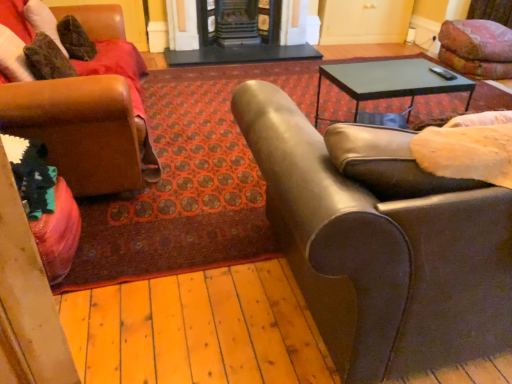
Question: Does marble fireplace at center, which is counted as the 1th fireplace, starting from the right, have a larger size compared to leather couch at right, the 2th chair when ordered from left to right?

Choices:
 (A) yes
 (B) no

Answer: (B)

Question: Is marble fireplace at center, the second fireplace positioned from the left, facing towards leather couch at right, the 1th chair viewed from the right?

Choices:
 (A) no
 (B) yes

Answer: (B)

Question: Does marble fireplace at center, which is counted as the 1th fireplace, starting from the right, have a lesser height compared to leather couch at right, the 2th chair when ordered from left to right?

Choices:
 (A) yes
 (B) no

Answer: (A)

Question: Is marble fireplace at center, which is counted as the 1th fireplace, starting from the right, beside leather couch at right, the 2th chair when ordered from left to right?

Choices:
 (A) no
 (B) yes

Answer: (A)

Question: Is marble fireplace at center, the second fireplace positioned from the left, far from leather couch at right, the 1th chair viewed from the right?

Choices:
 (A) yes
 (B) no

Answer: (A)

Question: Considering the relative sizes of marble fireplace at center, the second fireplace positioned from the left, and leather couch at right, the 1th chair viewed from the right, in the image provided, is marble fireplace at center, the second fireplace positioned from the left, taller than leather couch at right, the 1th chair viewed from the right,?

Choices:
 (A) no
 (B) yes

Answer: (A)

Question: Can you confirm if leather at left, the 1th chair in the left-to-right sequence, is positioned to the left of black glossy table at center?

Choices:
 (A) yes
 (B) no

Answer: (A)

Question: Is leather at left, the 1th chair in the left-to-right sequence, positioned before black glossy table at center?

Choices:
 (A) yes
 (B) no

Answer: (A)

Question: Would you consider leather at left, the 1th chair in the left-to-right sequence, to be distant from black glossy table at center?

Choices:
 (A) no
 (B) yes

Answer: (B)

Question: Is leather at left, the 1th chair in the left-to-right sequence, completely or partially outside of black glossy table at center?

Choices:
 (A) yes
 (B) no

Answer: (A)

Question: Does leather at left, the 1th chair in the left-to-right sequence, have a greater height compared to black glossy table at center?

Choices:
 (A) yes
 (B) no

Answer: (A)

Question: Is leather at left, the 1th chair in the left-to-right sequence, smaller than black glossy table at center?

Choices:
 (A) no
 (B) yes

Answer: (A)

Question: Considering the relative sizes of marble fireplace at center, arranged as the 2th fireplace when viewed from the right, and leather couch at right, the 2th chair when ordered from left to right, in the image provided, is marble fireplace at center, arranged as the 2th fireplace when viewed from the right, smaller than leather couch at right, the 2th chair when ordered from left to right,?

Choices:
 (A) no
 (B) yes

Answer: (B)